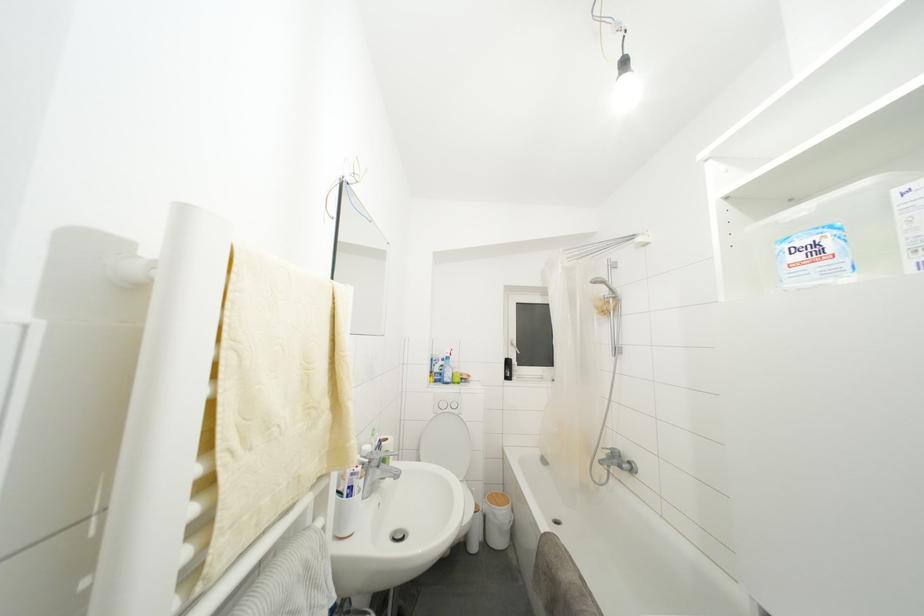
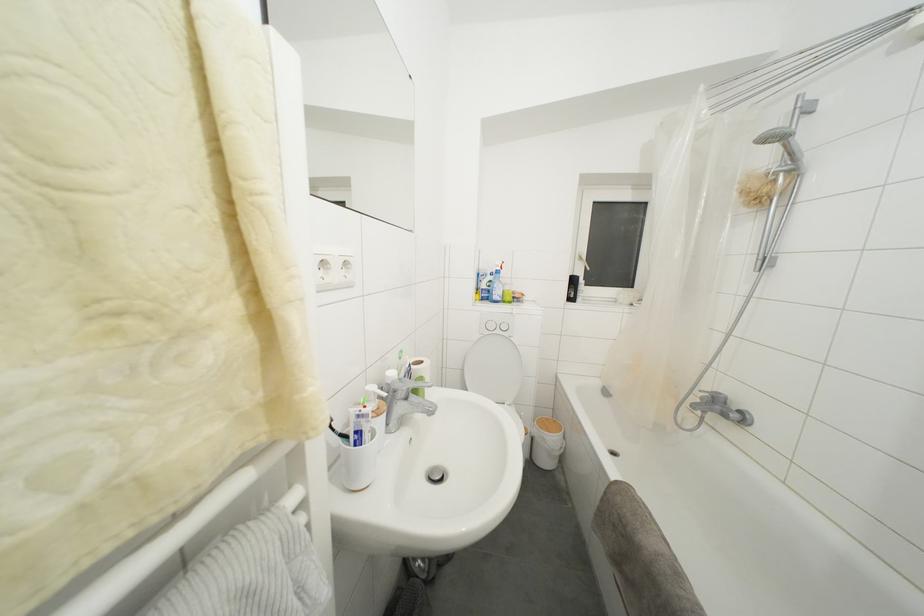
Question: The images are taken continuously from a first-person perspective. In which direction are you moving?

Choices:
 (A) Left
 (B) Right
 (C) Forward
 (D) Backward

Answer: (C)